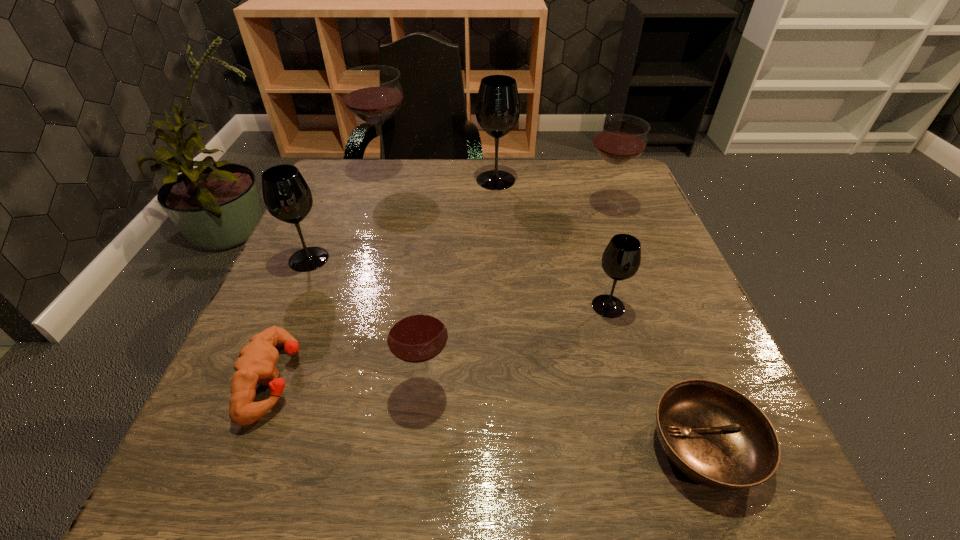
Identify the location of the fourth object from right to left. (497, 109).

Identify the location of the fourth wineglass from left to right. This screenshot has width=960, height=540. (497, 109).

The height and width of the screenshot is (540, 960). I want to click on the farthest red wineglass, so click(373, 93).

The width and height of the screenshot is (960, 540). I want to click on the leftmost red wineglass, so click(x=373, y=93).

The height and width of the screenshot is (540, 960). Identify the location of the third farthest wineglass. (620, 138).

Locate an element on the screen. the second smallest red wineglass is located at coordinates (620, 138).

Where is `the leftmost gray wineglass`? The image size is (960, 540). the leftmost gray wineglass is located at coordinates (287, 197).

This screenshot has height=540, width=960. Identify the location of the fifth nearest object. (287, 197).

Where is `the smallest red wineglass`? The image size is (960, 540). the smallest red wineglass is located at coordinates (417, 333).

You are a GUI agent. You are given a task and a screenshot of the screen. Output one action in this format:
    pyautogui.click(x=<x>, y=<y>)
    Task: Click on the nearest wineglass
    This screenshot has height=540, width=960.
    Given the screenshot: What is the action you would take?
    pyautogui.click(x=417, y=333)